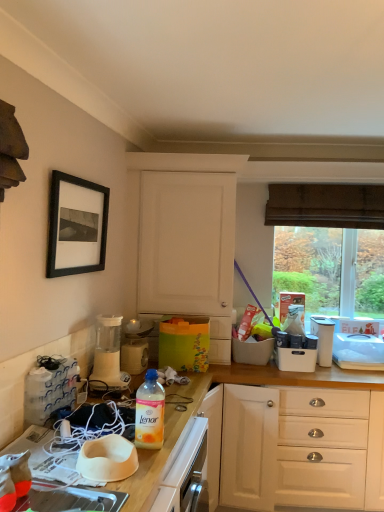
Describe the element at coordinates (326, 205) in the screenshot. I see `transparent glass window at upper right` at that location.

Describe the element at coordinates (323, 339) in the screenshot. The width and height of the screenshot is (384, 512). I see `white plastic container at upper right, which is the 1th appliance from back to front` at that location.

From the picture: How much space does white plastic bag at left, positioned as the fourth appliance in back-to-front order, occupy vertically?

10.74 inches.

Where is `white matte bowl at center`? The image size is (384, 512). white matte bowl at center is located at coordinates (107, 459).

From the picture: Is transparent glass window at upper right further to the viewer compared to white plastic container at upper right, which ranks as the fourth appliance in left-to-right order?

Yes, it is.

Are transparent glass window at upper right and white plastic container at upper right, the 1th appliance from the right, far apart?

transparent glass window at upper right is actually quite close to white plastic container at upper right, the 1th appliance from the right.

Is transparent glass window at upper right wider or thinner than white plastic container at upper right, which is the 1th appliance from back to front?

Considering their sizes, transparent glass window at upper right looks slimmer than white plastic container at upper right, which is the 1th appliance from back to front.

Is transparent glass window at upper right surrounding white plastic container at upper right, which ranks as the fourth appliance in left-to-right order?

That's incorrect, white plastic container at upper right, which ranks as the fourth appliance in left-to-right order, is not inside transparent glass window at upper right.

Is white matte cabinet at center to the left or to the right of transparent glass window at upper right in the image?

From the image, it's evident that white matte cabinet at center is to the left of transparent glass window at upper right.

Is white matte cabinet at center taller or shorter than transparent glass window at upper right?

Clearly, white matte cabinet at center is taller compared to transparent glass window at upper right.

Between white matte cabinet at center and transparent glass window at upper right, which one is positioned in front?

white matte cabinet at center is closer to the camera.

Is point (140, 262) positioned behind point (324, 348)?

No, it is in front of (324, 348).

Is white matte cabinet at center oriented towards white plastic container at upper right, which ranks as the fourth appliance in left-to-right order?

No.

Is white matte cabinet at center touching white plastic container at upper right, the 4th appliance positioned from the front?

white matte cabinet at center is not next to white plastic container at upper right, the 4th appliance positioned from the front, and they're not touching.

Based on the photo, is white plastic bag at left, the 1th appliance when ordered from front to back, at the right side of black matte picture frame at upper left?

Incorrect, white plastic bag at left, the 1th appliance when ordered from front to back, is not on the right side of black matte picture frame at upper left.

Is white plastic bag at left, which is the 4th appliance in right-to-left order, oriented towards black matte picture frame at upper left?

No, white plastic bag at left, which is the 4th appliance in right-to-left order, is not oriented towards black matte picture frame at upper left.

Looking at the image, does white plastic bag at left, the 1th appliance when ordered from front to back, seem bigger or smaller compared to black matte picture frame at upper left?

In the image, white plastic bag at left, the 1th appliance when ordered from front to back, appears to be smaller than black matte picture frame at upper left.

From the image's perspective, which is above, matte white blender at left, placed as the 3th appliance when sorted from right to left, or black matte picture frame at upper left?

black matte picture frame at upper left appears higher in the image.

Choose the correct answer: Is matte white blender at left, which is the 3th appliance from back to front, inside black matte picture frame at upper left or outside it?

matte white blender at left, which is the 3th appliance from back to front, lies outside black matte picture frame at upper left.

Is matte white blender at left, placed as the 3th appliance when sorted from right to left, aimed at black matte picture frame at upper left?

No, matte white blender at left, placed as the 3th appliance when sorted from right to left, is not facing towards black matte picture frame at upper left.

Which object is positioned more to the right, matte white blender at left, placed as the 3th appliance when sorted from right to left, or black matte picture frame at upper left?

Positioned to the right is matte white blender at left, placed as the 3th appliance when sorted from right to left.

Does white plastic bag at left, positioned as the fourth appliance in back-to-front order, come behind white plastic container at upper right, which is the 1th appliance from back to front?

No, it is not.

Considering the positions of objects white plastic bag at left, which is the 4th appliance in right-to-left order, and white plastic container at upper right, the 1th appliance from the right, in the image provided, who is more to the left, white plastic bag at left, which is the 4th appliance in right-to-left order, or white plastic container at upper right, the 1th appliance from the right,?

From the viewer's perspective, white plastic bag at left, which is the 4th appliance in right-to-left order, appears more on the left side.

How much distance is there between white plastic bag at left, the 1th appliance when ordered from front to back, and white plastic container at upper right, which ranks as the fourth appliance in left-to-right order?

white plastic bag at left, the 1th appliance when ordered from front to back, and white plastic container at upper right, which ranks as the fourth appliance in left-to-right order, are 1.64 meters apart.

From the image's perspective, would you say white plastic bag at left, positioned as the fourth appliance in back-to-front order, is shown under white plastic container at upper right, which ranks as the fourth appliance in left-to-right order?

No.

Considering the points (311, 326) and (73, 248), which point is in front, point (311, 326) or point (73, 248)?

Point (73, 248)

Consider the image. Considering the relative sizes of white plastic container at upper right, which ranks as the fourth appliance in left-to-right order, and black matte picture frame at upper left in the image provided, is white plastic container at upper right, which ranks as the fourth appliance in left-to-right order, taller than black matte picture frame at upper left?

In fact, white plastic container at upper right, which ranks as the fourth appliance in left-to-right order, may be shorter than black matte picture frame at upper left.

Considering the relative sizes of white plastic container at upper right, the 4th appliance positioned from the front, and black matte picture frame at upper left in the image provided, is white plastic container at upper right, the 4th appliance positioned from the front, thinner than black matte picture frame at upper left?

In fact, white plastic container at upper right, the 4th appliance positioned from the front, might be wider than black matte picture frame at upper left.

This screenshot has width=384, height=512. What are the coordinates of `window on the right of white plastic container at upper right, which is the 1th appliance from back to front` in the screenshot? It's located at (326, 205).

I want to click on window that appears below the white matte cabinet at center (from the image's perspective), so click(326, 205).

Looking at the image, which one is located further to white matte bowl at center, black matte picture frame at upper left or white plastic blender at center, acting as the second appliance starting from the right?

Among the two, white plastic blender at center, acting as the second appliance starting from the right, is located further to white matte bowl at center.

Estimate the real-world distances between objects in this image. Which object is further from translucent plastic bottle at lower center, black matte picture frame at upper left or white plastic bag at left, positioned as the fourth appliance in back-to-front order?

The object further to translucent plastic bottle at lower center is black matte picture frame at upper left.

Looking at the image, which one is located further to matte white blender at left, which is the 3th appliance from back to front, translucent plastic bottle at lower center or transparent glass window at upper right?

transparent glass window at upper right lies further to matte white blender at left, which is the 3th appliance from back to front, than the other object.

Estimate the real-world distances between objects in this image. Which object is closer to transparent glass window at upper right, white plastic blender at center, the 3th appliance viewed from the front, or white matte cabinet at center?

Based on the image, white matte cabinet at center appears to be nearer to transparent glass window at upper right.

When comparing their distances from black matte picture frame at upper left, does white plastic blender at center, acting as the second appliance starting from the right, or translucent plastic bottle at lower center seem closer?

The object closer to black matte picture frame at upper left is white plastic blender at center, acting as the second appliance starting from the right.

Based on the photo, which object lies nearer to the anchor point white plastic blender at center, acting as the second appliance starting from the right, white plastic bag at left, acting as the first appliance starting from the left, or translucent plastic bottle at lower center?

The object closer to white plastic blender at center, acting as the second appliance starting from the right, is white plastic bag at left, acting as the first appliance starting from the left.

Considering their positions, is white matte cabinet at center positioned further to white plastic bag at left, acting as the first appliance starting from the left, than black matte picture frame at upper left?

The object further to white plastic bag at left, acting as the first appliance starting from the left, is white matte cabinet at center.

From the picture: Estimate the real-world distances between objects in this image. Which object is closer to translucent plastic bottle at lower center, white plastic container at upper right, the 1th appliance from the right, or white matte cabinet at center?

white matte cabinet at center.

Locate an element on the screen. bottle between black matte picture frame at upper left and white matte bowl at center in the up-down direction is located at coordinates (150, 412).

This screenshot has height=512, width=384. In order to click on bowl between white plastic bag at left, acting as the first appliance starting from the left, and white plastic container at upper right, which is the 1th appliance from back to front in this screenshot , I will do 107,459.

You are a GUI agent. You are given a task and a screenshot of the screen. Output one action in this format:
    pyautogui.click(x=<x>, y=<y>)
    Task: Click on the appliance located between white matte cabinet at center and transparent glass window at upper right in the left-right direction
    The height and width of the screenshot is (512, 384).
    Given the screenshot: What is the action you would take?
    pyautogui.click(x=323, y=339)

Locate an element on the screen. cabinetry between translucent plastic bottle at lower center and white plastic container at upper right, which is the 1th appliance from back to front, along the z-axis is located at coordinates (186, 243).